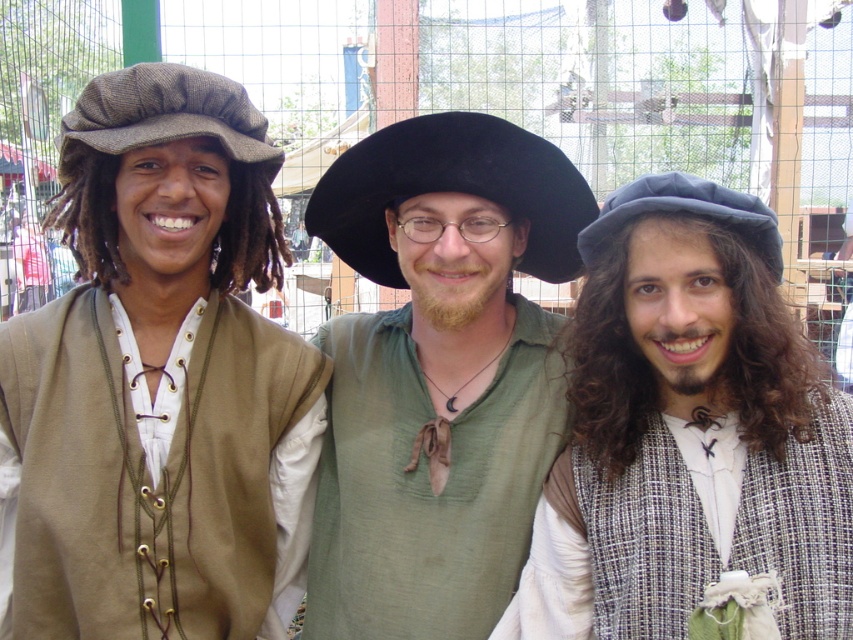
Locate an element on the screen. The image size is (853, 640). matte green vest at center is located at coordinates (438, 372).

Looking at this image, is matte green vest at center smaller than brown woolen cap at left?

Incorrect, matte green vest at center is not smaller in size than brown woolen cap at left.

Where is `matte green vest at center`? matte green vest at center is located at coordinates (438, 372).

Can you confirm if matte green vest at center is smaller than dark blue fabric hat at center?

Actually, matte green vest at center might be larger than dark blue fabric hat at center.

Who is lower down, matte green vest at center or dark blue fabric hat at center?

matte green vest at center is below.

Measure the distance between point (369, 164) and camera.

The distance of point (369, 164) from camera is 38.08 meters.

Image resolution: width=853 pixels, height=640 pixels. Identify the location of matte green vest at center. (438, 372).

Who is taller, brown woolen cap at left or dark blue fabric hat at center?

brown woolen cap at left is taller.

Is brown woolen cap at left to the right of dark blue fabric hat at center from the viewer's perspective?

Incorrect, brown woolen cap at left is not on the right side of dark blue fabric hat at center.

Describe the element at coordinates (161, 115) in the screenshot. I see `brown woolen cap at left` at that location.

Identify the location of brown woolen cap at left. (161, 115).